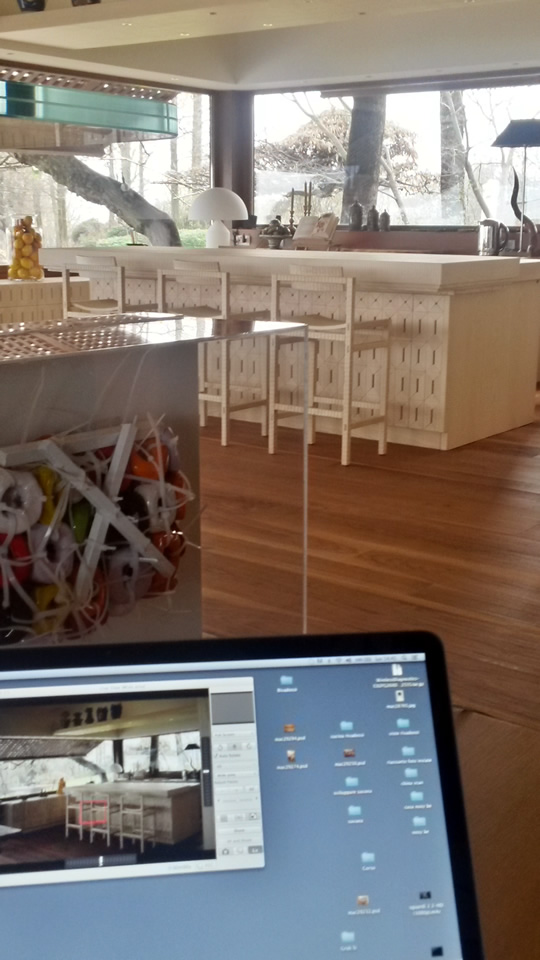
The image size is (540, 960). Find the location of `glass`. glass is located at coordinates (14, 232).